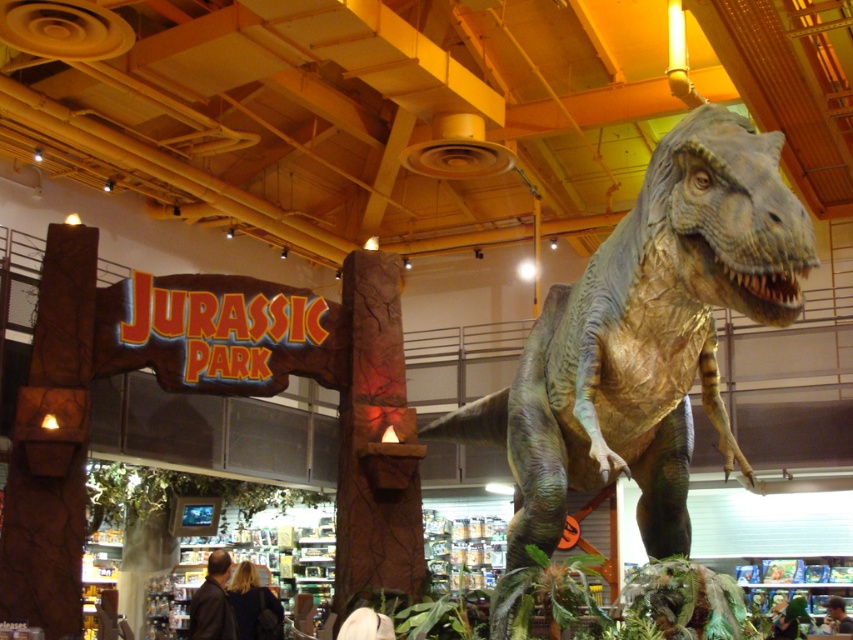
You are a customer in the store and want to take a photo of the green textured dinosaur at center and the brown cracked stone at center. Which object should you focus on first if you want to ensure both are in the frame without moving the camera?

You should focus on the green textured dinosaur at center first because it is larger than the brown cracked stone at center, so positioning it correctly will help frame both objects properly.

You are a parent trying to buy a gift for your child who is 1.2 meters tall. You see the green textured dinosaur at center and the brown cracked stone at center in the store. Which object is safer for your child to climb on?

The brown cracked stone at center is safer for the child to climb on because the green textured dinosaur at center is much taller than the brown cracked stone at center, making it a better height for the child.

Looking at this image, you are a visitor at the Jurassic Park store and want to take a photo of both the green textured dinosaur at center and the brown cracked stone at center. Which object should you focus on first to ensure both are in the frame?

You should focus on the green textured dinosaur at center first since it is closer to you than the brown cracked stone at center, ensuring both are in the frame by adjusting the camera angle accordingly.